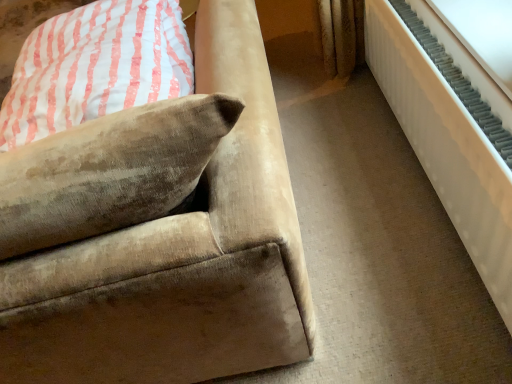
Question: Is white textured radiator at right wider or thinner than velvet beige pillow at upper left?

Choices:
 (A) wide
 (B) thin

Answer: (B)

Question: Is white textured radiator at right inside the boundaries of velvet beige pillow at upper left, or outside?

Choices:
 (A) outside
 (B) inside

Answer: (A)

Question: Which object is the farthest from the white textured radiator at right?

Choices:
 (A) velvet beige couch at lower left
 (B) velvet beige pillow at upper left

Answer: (B)

Question: Which is farther from the white textured radiator at right?

Choices:
 (A) velvet beige pillow at upper left
 (B) velvet beige couch at lower left

Answer: (A)